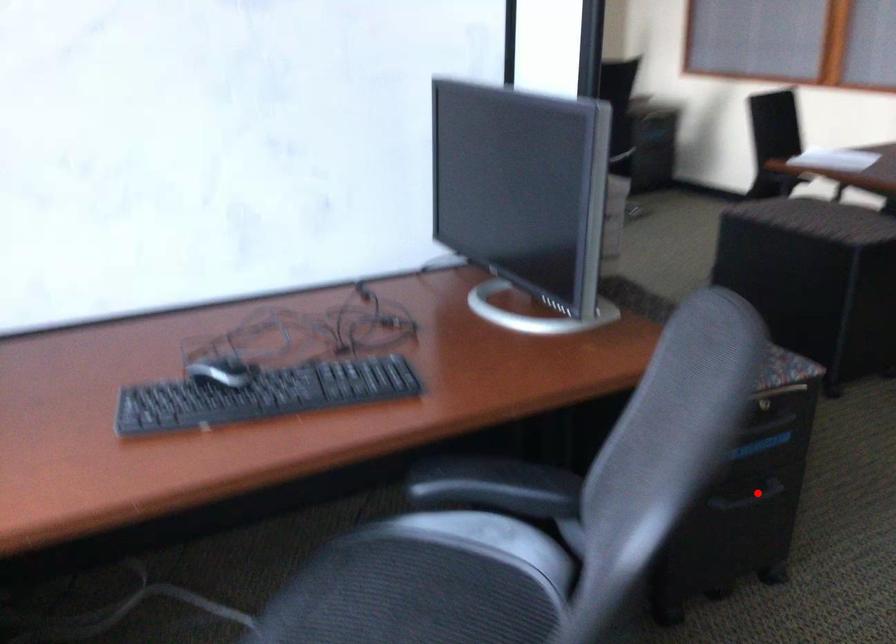
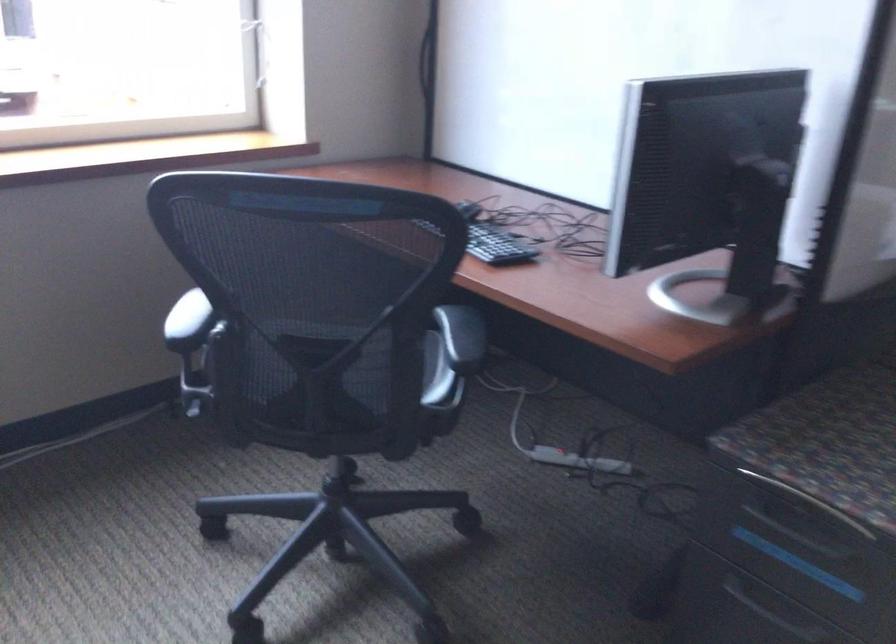
In the second image, find the point that corresponds to the highlighted location in the first image.

(778, 614)